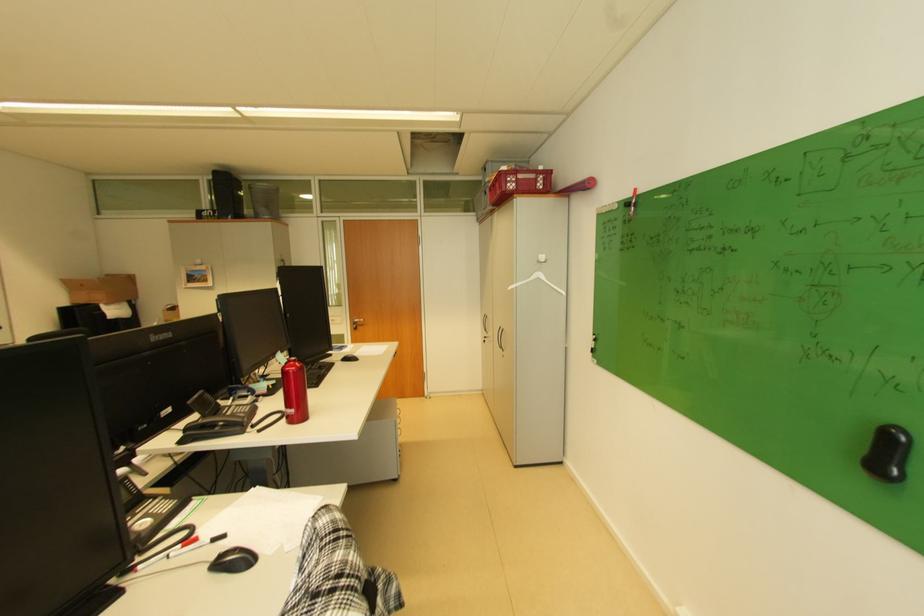
Find where to lift the black phone handset. Please return your answer as a coordinate pair (x, y).

(220, 421)